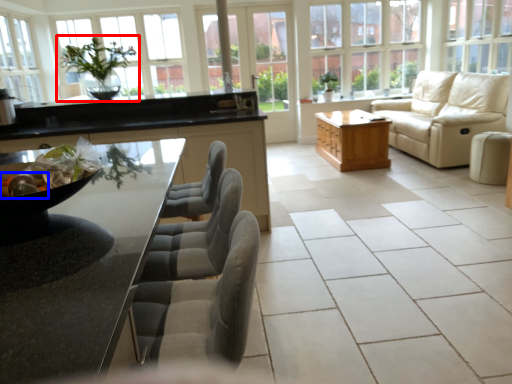
Question: Which of the following is the farthest to the observer, houseplant (highlighted by a red box) or food (highlighted by a blue box)?

Choices:
 (A) houseplant
 (B) food

Answer: (A)